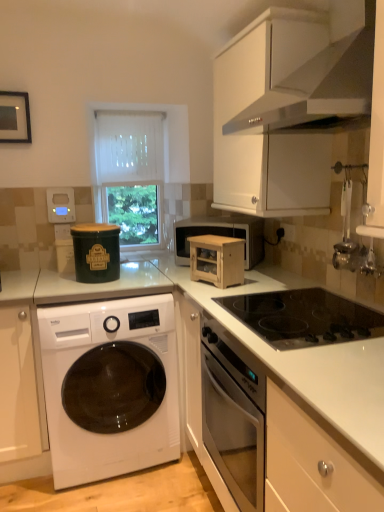
The height and width of the screenshot is (512, 384). Describe the element at coordinates (96, 252) in the screenshot. I see `green matte container at upper left, acting as the second appliance starting from the back` at that location.

Describe the element at coordinates (221, 234) in the screenshot. I see `wooden microwave at center` at that location.

I want to click on white matte cabinet at upper right, the second cabinetry ordered from the bottom, so point(248,124).

Describe the element at coordinates (61, 205) in the screenshot. I see `matte white thermostat at upper left, which is counted as the 1th appliance, starting from the left` at that location.

This screenshot has height=512, width=384. I want to click on white sheer curtain at center, so click(131, 174).

At what (x,y) coordinates should I click in order to perform the action: click on white matte exhaust hood at upper right. Please return your answer as a coordinate pair (x, y). Looking at the image, I should click on (314, 69).

Is wooden cabinet at center, which is the 1th appliance from right to left, bigger than white matte cabinet at lower left, marked as the first cabinetry in a bottom-to-top arrangement?

No.

Is wooden cabinet at center, the third appliance when ordered from back to front, aimed at white matte cabinet at lower left, the second cabinetry in the right-to-left sequence?

No, wooden cabinet at center, the third appliance when ordered from back to front, is not oriented towards white matte cabinet at lower left, the second cabinetry in the right-to-left sequence.

From the image's perspective, between wooden cabinet at center, which is the 1th appliance from right to left, and white matte cabinet at lower left, marked as the first cabinetry in a bottom-to-top arrangement, who is located below?

white matte cabinet at lower left, marked as the first cabinetry in a bottom-to-top arrangement, from the image's perspective.

From a real-world perspective, is wooden cabinet at center, which is the 1th appliance from right to left, physically above white matte cabinet at lower left, the second cabinetry in the top-to-bottom sequence?

Yes.

Does green matte container at upper left, acting as the second appliance starting from the back, have a lesser width compared to wooden microwave at center?

Yes.

Between green matte container at upper left, the second appliance in the front-to-back sequence, and wooden microwave at center, which one has smaller size?

Smaller between the two is green matte container at upper left, the second appliance in the front-to-back sequence.

Which object is closer to the camera taking this photo, green matte container at upper left, acting as the second appliance starting from the left, or wooden microwave at center?

green matte container at upper left, acting as the second appliance starting from the left.

Based on the photo, is green matte container at upper left, the second appliance in the front-to-back sequence, oriented towards wooden microwave at center?

No, green matte container at upper left, the second appliance in the front-to-back sequence, is not aimed at wooden microwave at center.

Is white matte cabinet at lower left, marked as the first cabinetry in a bottom-to-top arrangement, positioned beyond the bounds of matte white thermostat at upper left, marked as the third appliance in a right-to-left arrangement?

Yes, white matte cabinet at lower left, marked as the first cabinetry in a bottom-to-top arrangement, is outside of matte white thermostat at upper left, marked as the third appliance in a right-to-left arrangement.

From a real-world perspective, is white matte cabinet at lower left, the second cabinetry in the top-to-bottom sequence, beneath matte white thermostat at upper left, marked as the third appliance in a right-to-left arrangement?

Yes, from a real-world perspective, white matte cabinet at lower left, the second cabinetry in the top-to-bottom sequence, is below matte white thermostat at upper left, marked as the third appliance in a right-to-left arrangement.

Consider the image. Is white matte cabinet at lower left, the second cabinetry in the top-to-bottom sequence, next to matte white thermostat at upper left, marked as the third appliance in a right-to-left arrangement, and touching it?

No.

Is white matte cabinet at upper right, which ranks as the 1th cabinetry in top-to-bottom order, beside black glass cooktop at center?

No.

Consider the image. Which object is positioned more to the left, white matte cabinet at upper right, which appears as the second cabinetry when viewed from the left, or black glass cooktop at center?

Answer: Positioned to the left is white matte cabinet at upper right, which appears as the second cabinetry when viewed from the left.

Considering the relative sizes of white matte cabinet at upper right, which appears as the second cabinetry when viewed from the left, and black glass cooktop at center in the image provided, is white matte cabinet at upper right, which appears as the second cabinetry when viewed from the left, bigger than black glass cooktop at center?

Correct, white matte cabinet at upper right, which appears as the second cabinetry when viewed from the left, is larger in size than black glass cooktop at center.

Is point (243, 70) positioned behind point (295, 311)?

Yes, point (243, 70) is behind point (295, 311).

From a real-world perspective, is white sheer curtain at center beneath white matte exhaust hood at upper right?

Yes, from a real-world perspective, white sheer curtain at center is beneath white matte exhaust hood at upper right.

Can you confirm if white sheer curtain at center is positioned to the left of white matte exhaust hood at upper right?

Yes, white sheer curtain at center is to the left of white matte exhaust hood at upper right.

Where is `exhaust hood located on the right of white sheer curtain at center`? exhaust hood located on the right of white sheer curtain at center is located at coordinates tap(314, 69).

Is white sheer curtain at center with white matte exhaust hood at upper right?

No, white sheer curtain at center is not in contact with white matte exhaust hood at upper right.

Is white matte cabinet at lower left, marked as the first cabinetry in a bottom-to-top arrangement, not near white sheer curtain at center?

Absolutely, white matte cabinet at lower left, marked as the first cabinetry in a bottom-to-top arrangement, is distant from white sheer curtain at center.

In the image, there is a white sheer curtain at center. At what (x,y) coordinates should I click in order to perform the action: click on cabinetry below it (from a real-world perspective). Please return your answer as a coordinate pair (x, y). Looking at the image, I should click on (18, 386).

Measure the distance from white matte cabinet at lower left, marked as the first cabinetry in a bottom-to-top arrangement, to white sheer curtain at center.

They are 1.21 meters apart.

From a real-world perspective, between white matte cabinet at lower left, the second cabinetry in the right-to-left sequence, and white sheer curtain at center, who is vertically lower?

In real-world perspective, white matte cabinet at lower left, the second cabinetry in the right-to-left sequence, is lower.

Is white matte exhaust hood at upper right beside wooden cabinet at center, which is the 1th appliance from right to left?

white matte exhaust hood at upper right and wooden cabinet at center, which is the 1th appliance from right to left, are not in contact.

Does white matte exhaust hood at upper right contain wooden cabinet at center, marked as the 3th appliance in a left-to-right arrangement?

No, white matte exhaust hood at upper right does not contain wooden cabinet at center, marked as the 3th appliance in a left-to-right arrangement.

Considering the relative positions of white matte exhaust hood at upper right and wooden cabinet at center, marked as the 3th appliance in a left-to-right arrangement, in the image provided, is white matte exhaust hood at upper right behind wooden cabinet at center, marked as the 3th appliance in a left-to-right arrangement,?

No, it is in front of wooden cabinet at center, marked as the 3th appliance in a left-to-right arrangement.

From the picture: Considering the relative positions of white matte exhaust hood at upper right and wooden cabinet at center, marked as the 3th appliance in a left-to-right arrangement, in the image provided, is white matte exhaust hood at upper right to the right of wooden cabinet at center, marked as the 3th appliance in a left-to-right arrangement, from the viewer's perspective?

Yes, white matte exhaust hood at upper right is to the right of wooden cabinet at center, marked as the 3th appliance in a left-to-right arrangement.

Locate an element on the screen. This screenshot has width=384, height=512. cabinetry below the wooden cabinet at center, which is the 1th appliance from right to left (from the image's perspective) is located at coordinates (18, 386).

From the wooden microwave at center, count the 2nd appliance to the left and point to it. Please provide its 2D coordinates.

[(96, 252)]

Which object lies nearer to the anchor point wooden microwave at center, white matte cabinet at lower left, marked as the first cabinetry in a bottom-to-top arrangement, or wooden cabinet at center, the third appliance when ordered from back to front?

Based on the image, wooden cabinet at center, the third appliance when ordered from back to front, appears to be nearer to wooden microwave at center.

Estimate the real-world distances between objects in this image. Which object is further from white matte exhaust hood at upper right, matte white thermostat at upper left, which is counted as the 1th appliance, starting from the left, or wooden microwave at center?

Based on the image, matte white thermostat at upper left, which is counted as the 1th appliance, starting from the left, appears to be further to white matte exhaust hood at upper right.

When comparing their distances from white matte cabinet at upper right, which ranks as the 1th cabinetry in top-to-bottom order, does white matte exhaust hood at upper right or wooden microwave at center seem closer?

white matte exhaust hood at upper right is closer to white matte cabinet at upper right, which ranks as the 1th cabinetry in top-to-bottom order.

Which object lies nearer to the anchor point white sheer curtain at center, white glossy washing machine at lower left or wooden cabinet at center, marked as the 3th appliance in a left-to-right arrangement?

wooden cabinet at center, marked as the 3th appliance in a left-to-right arrangement.

When comparing their distances from white matte exhaust hood at upper right, does white sheer curtain at center or white glossy washing machine at lower left seem further?

The object further to white matte exhaust hood at upper right is white glossy washing machine at lower left.

Estimate the real-world distances between objects in this image. Which object is further from white glossy washing machine at lower left, matte white thermostat at upper left, the third appliance positioned from the front, or black glass cooktop at center?

matte white thermostat at upper left, the third appliance positioned from the front, is positioned further to the anchor white glossy washing machine at lower left.

Based on their spatial positions, is matte white thermostat at upper left, which is counted as the 1th appliance, starting from the left, or white sheer curtain at center further from white glossy washing machine at lower left?

Based on the image, white sheer curtain at center appears to be further to white glossy washing machine at lower left.

Considering their positions, is matte white thermostat at upper left, the 1th appliance viewed from the back, positioned further to white sheer curtain at center than black glass cooktop at center?

The object further to white sheer curtain at center is black glass cooktop at center.

At what (x,y) coordinates should I click in order to perform the action: click on appliance between green matte container at upper left, acting as the second appliance starting from the back, and wooden microwave at center. Please return your answer as a coordinate pair (x, y). Looking at the image, I should click on (217, 260).

Where is `microwave oven located between black glass cooktop at center and matte white thermostat at upper left, the third appliance positioned from the front, in the depth direction`? The height and width of the screenshot is (512, 384). microwave oven located between black glass cooktop at center and matte white thermostat at upper left, the third appliance positioned from the front, in the depth direction is located at coordinates (221, 234).

Identify the location of window located between matte white thermostat at upper left, the third appliance positioned from the front, and wooden microwave at center in the left-right direction. This screenshot has height=512, width=384. (131, 174).

Image resolution: width=384 pixels, height=512 pixels. Identify the location of microwave oven between white matte exhaust hood at upper right and white glossy washing machine at lower left from top to bottom. [221, 234].